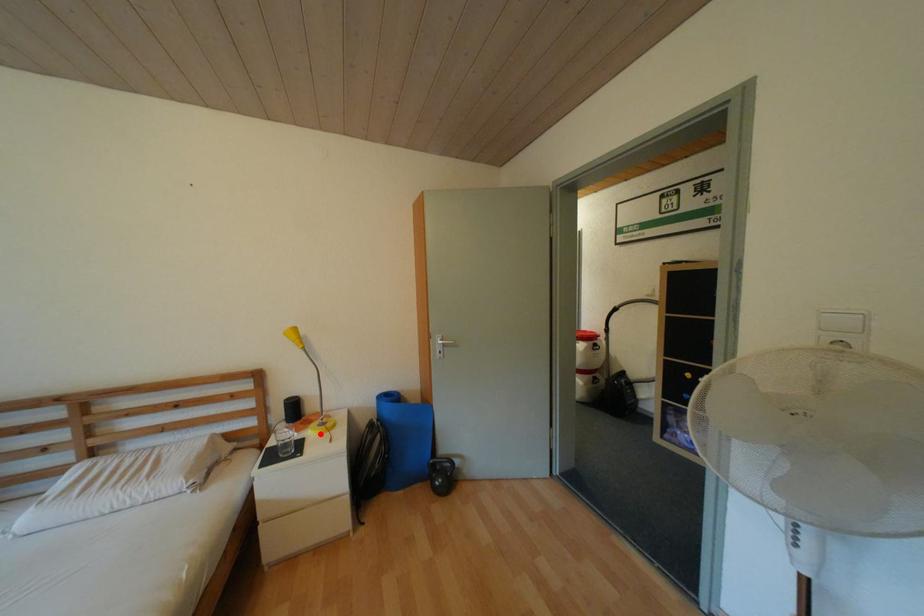
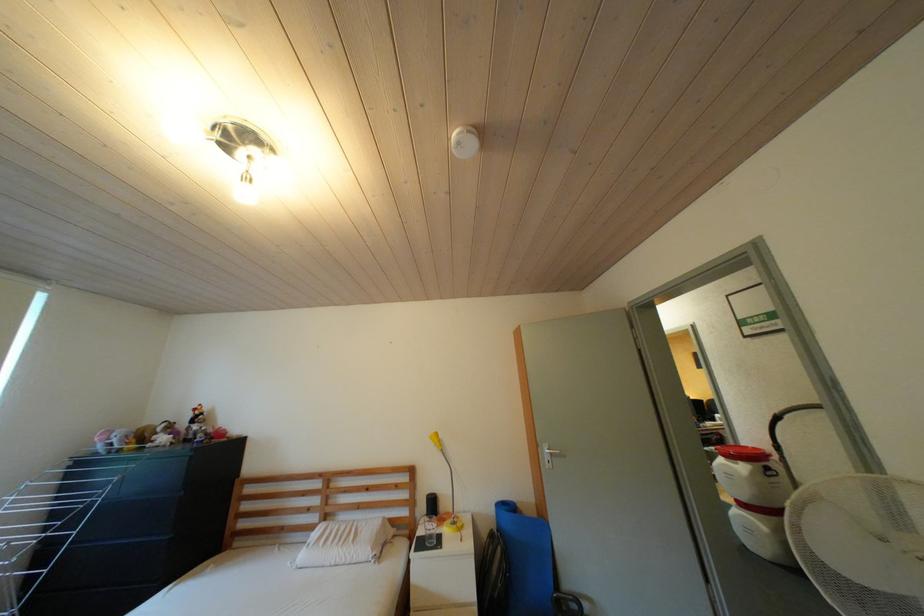
Locate, in the second image, the point that corresponds to the highlighted location in the first image.

(456, 531)